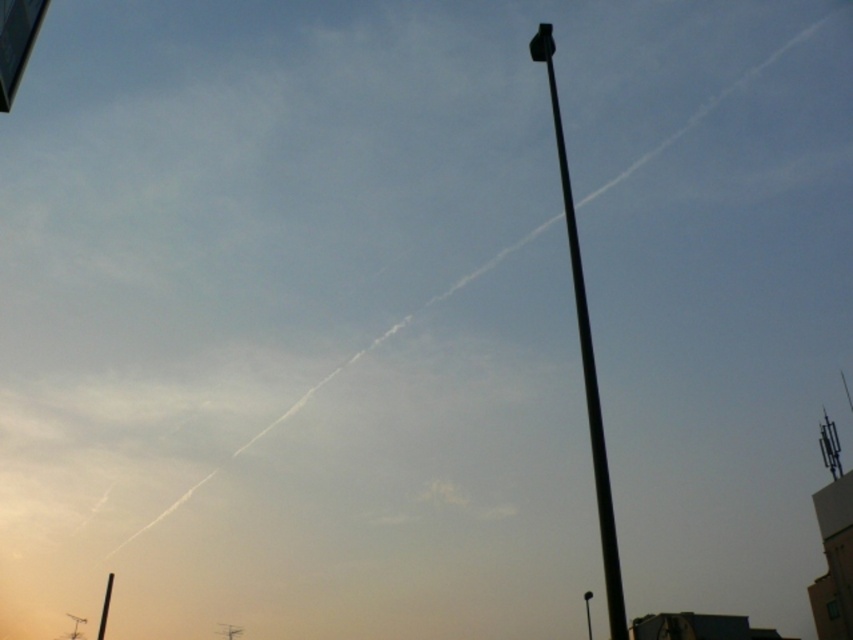
Question: Which object is positioned closest to the black metal pole at upper right?

Choices:
 (A) metallic rectangular sign at upper left
 (B) black metal pole at lower left
 (C) black metal pole at right

Answer: (A)

Question: Can you confirm if black metal pole at upper right is bigger than black metal pole at right?

Choices:
 (A) no
 (B) yes

Answer: (A)

Question: Is the position of black metal pole at upper right less distant than that of black metal pole at right?

Choices:
 (A) yes
 (B) no

Answer: (A)

Question: Which point is farther from the camera taking this photo?

Choices:
 (A) (99, 624)
 (B) (21, 72)
 (C) (622, 636)

Answer: (A)

Question: Which object is the closest to the metallic rectangular sign at upper left?

Choices:
 (A) black metal pole at lower left
 (B) black metal pole at right

Answer: (A)

Question: Considering the relative positions of black metal pole at upper right and black metal pole at right in the image provided, where is black metal pole at upper right located with respect to black metal pole at right?

Choices:
 (A) right
 (B) left

Answer: (B)